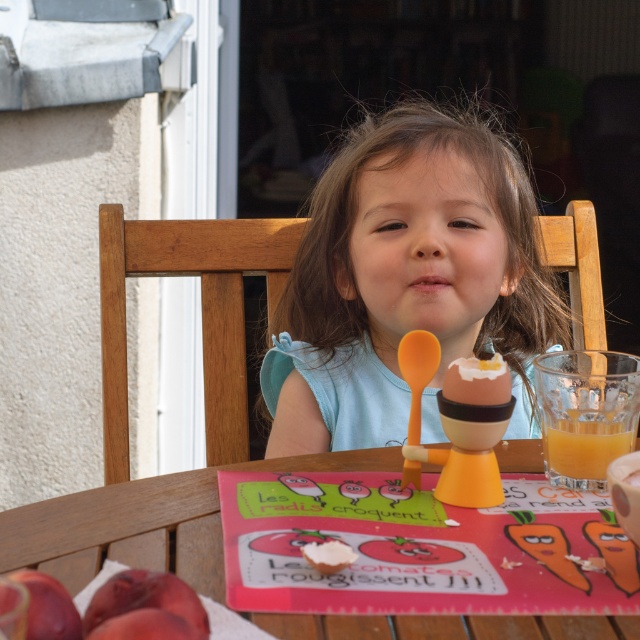
Question: Which object is the closest to the translucent glass cup at right?

Choices:
 (A) matte blue shirt at center
 (B) wooden table at center

Answer: (B)

Question: Can you confirm if matte blue shirt at center is positioned to the right of translucent glass cup at right?

Choices:
 (A) no
 (B) yes

Answer: (A)

Question: Is matte blue shirt at center to the left of translucent glass cup at right from the viewer's perspective?

Choices:
 (A) yes
 (B) no

Answer: (A)

Question: Among these points, which one is nearest to the camera?

Choices:
 (A) (35, 550)
 (B) (573, 429)

Answer: (A)

Question: Which of the following is the closest to the observer?

Choices:
 (A) (188, 484)
 (B) (320, 397)

Answer: (A)

Question: Is matte blue shirt at center smaller than translucent glass cup at right?

Choices:
 (A) no
 (B) yes

Answer: (A)